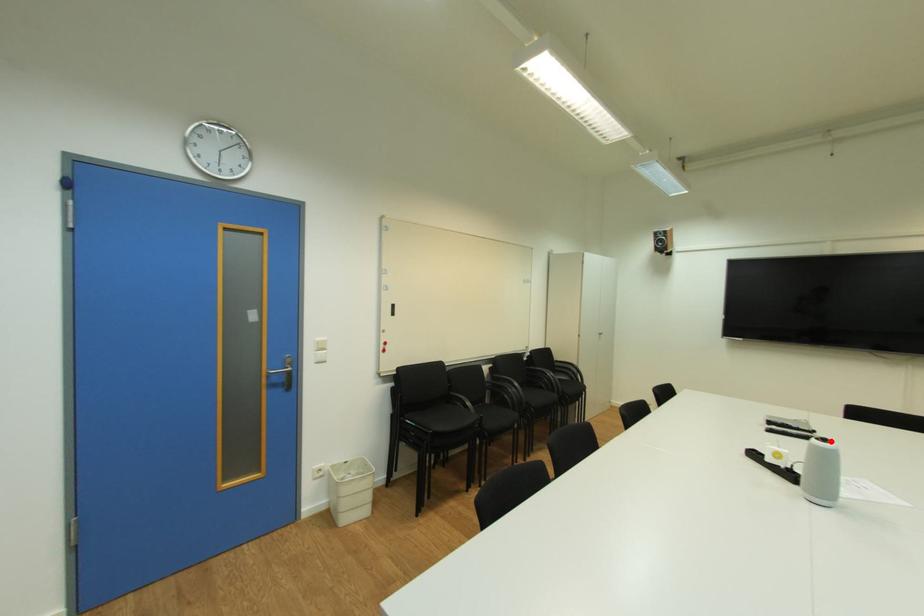
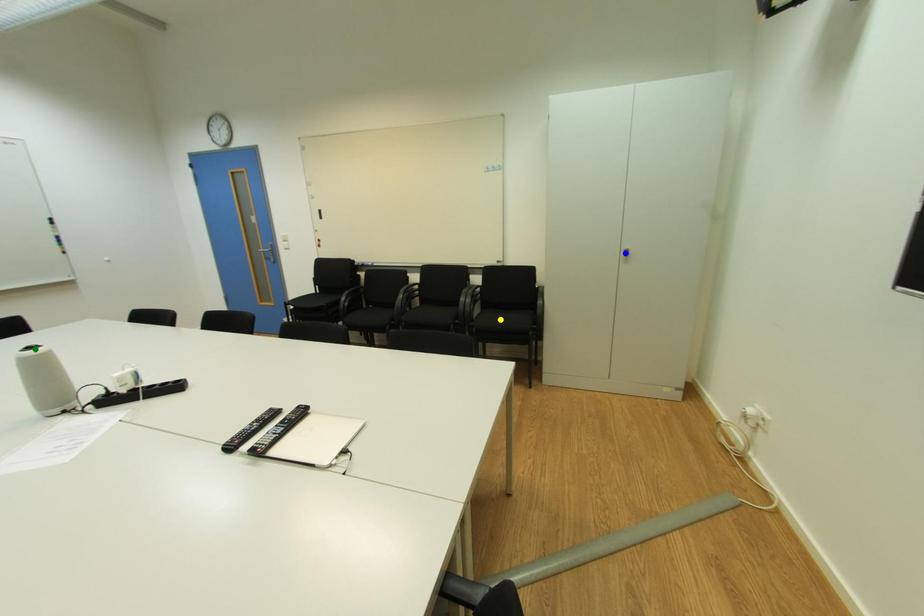
Question: I am providing you with two images of the same scene from different viewpoints. A red point is marked on the first image. You are given multiple points on the second image. Which point in image 2 is actually the same real-world point as the red point in image 1?

Choices:
 (A) green point
 (B) blue point
 (C) yellow point

Answer: (A)